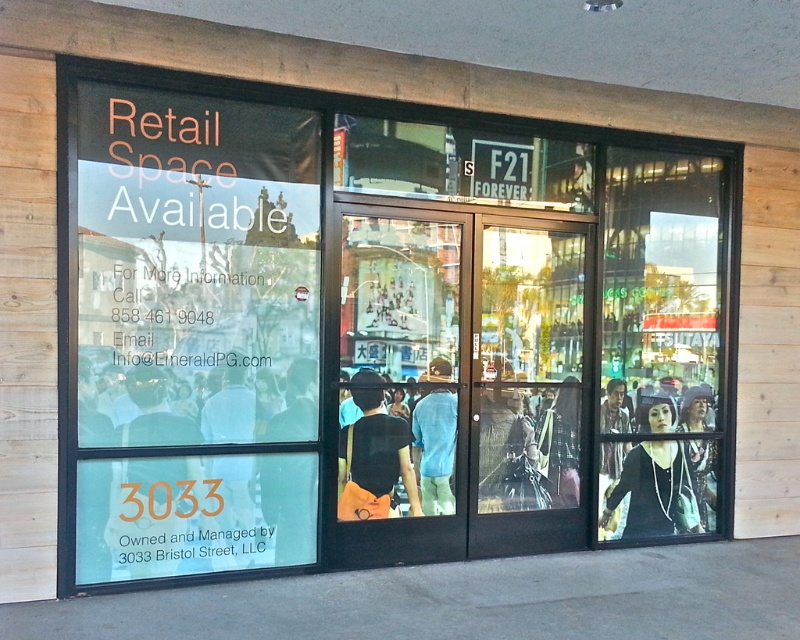
Question: Is matte black jacket at right thinner than black matte shirt at center?

Choices:
 (A) yes
 (B) no

Answer: (B)

Question: Which point appears farthest from the camera in this image?

Choices:
 (A) (645, 449)
 (B) (154, 376)
 (C) (372, 467)
 (D) (410, 428)

Answer: (A)

Question: Does transparent glass doors at center appear on the left side of blue cotton shirt at center?

Choices:
 (A) yes
 (B) no

Answer: (B)

Question: Does matte black jacket at right have a greater width compared to black matte shirt at center?

Choices:
 (A) no
 (B) yes

Answer: (B)

Question: Which of the following is the closest to the observer?

Choices:
 (A) (136, 120)
 (B) (434, 456)
 (C) (664, 404)

Answer: (A)

Question: Which is farther from the black matte shirt at center?

Choices:
 (A) transparent glass doors at center
 (B) matte black jacket at right
 (C) blue cotton shirt at center

Answer: (B)